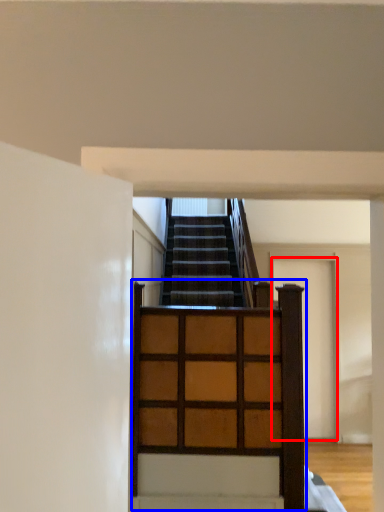
Question: Which object appears farthest to the camera in this image, door (highlighted by a red box) or dresser (highlighted by a blue box)?

Choices:
 (A) door
 (B) dresser

Answer: (A)